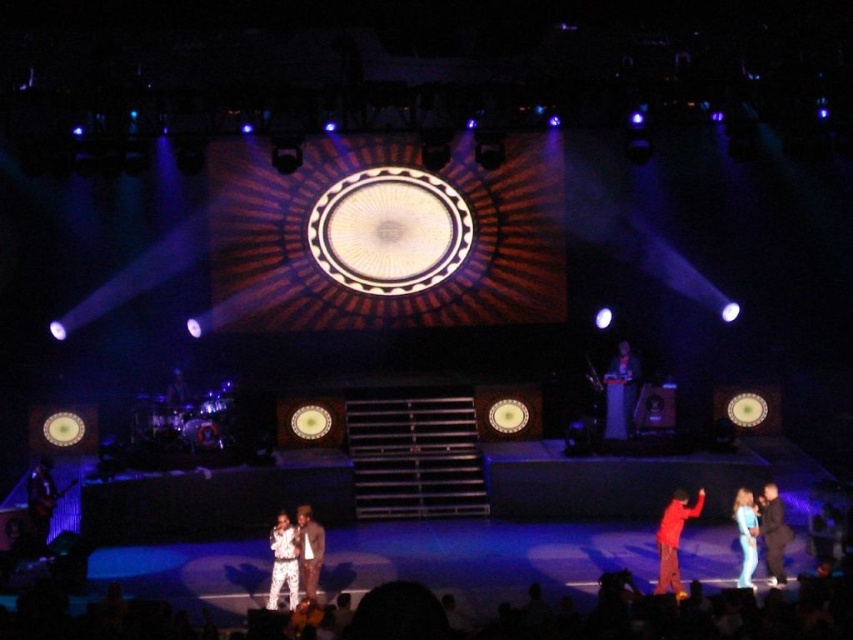
You are a photographer at the concert venue and want to capture a photo of both the white sequined outfit at center and the shiny brown suit at center. Which one should you focus on first to ensure both are in sharp focus?

You should focus on the white sequened outfit at center first since it is closer to the viewer than the shiny brown suit at center. By focusing on the closer object, the background object will still be in acceptable focus due to the depth of field, ensuring both are sharp.

You are a photographer at the concert venue and want to capture a closeup of the matte red pants at lower right and dark blue suit at lower right. Which one will appear larger in your photo?

The matte red pants at lower right will appear larger in the photo because it is closer to the viewer than the dark blue suit at lower right.